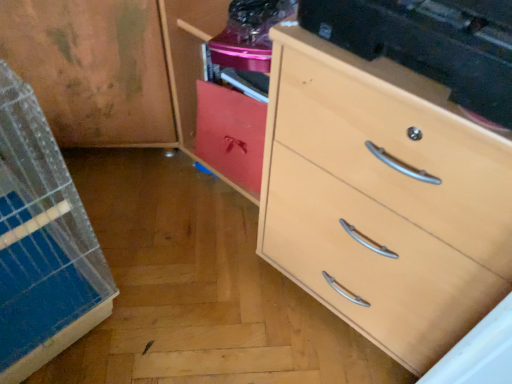
In order to click on vacant area in front of matte red cabinet at center in this screenshot , I will do `click(219, 224)`.